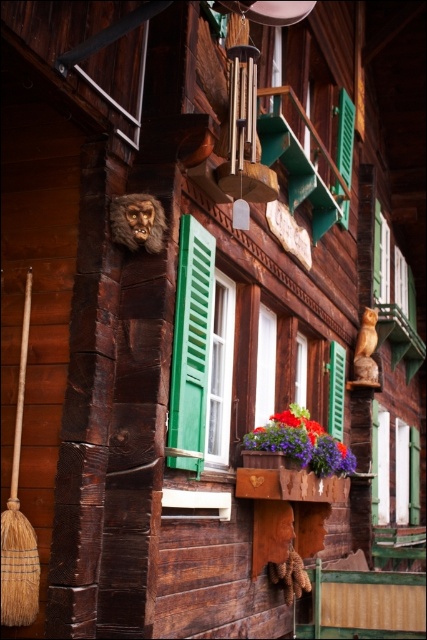
Which is more to the right, green matte shutter at center or wooden flower box at center?

Positioned to the right is wooden flower box at center.

Does green matte shutter at center have a lesser width compared to wooden flower box at center?

Yes, green matte shutter at center is thinner than wooden flower box at center.

Is point (193, 396) in front of point (278, 456)?

Yes.

What are the coordinates of `green matte shutter at center` in the screenshot? It's located at (190, 348).

Who is positioned more to the left, green matte shutter at center or vivid purple petals at center?

Positioned to the left is green matte shutter at center.

Does green matte shutter at center have a greater width compared to vivid purple petals at center?

Incorrect, green matte shutter at center's width does not surpass vivid purple petals at center's.

Which is in front, point (204, 403) or point (280, 429)?

Point (204, 403) is in front.

Identify the location of green matte shutter at center. This screenshot has width=427, height=640. (190, 348).

Can you confirm if vivid purple petals at center is positioned to the right of wooden flower box at center?

In fact, vivid purple petals at center is to the left of wooden flower box at center.

Can you confirm if vivid purple petals at center is thinner than wooden flower box at center?

Incorrect, vivid purple petals at center's width is not less than wooden flower box at center's.

Between point (295, 436) and point (316, 490), which one is positioned behind?

Positioned behind is point (316, 490).

Locate an element on the screen. vivid purple petals at center is located at coordinates (301, 442).